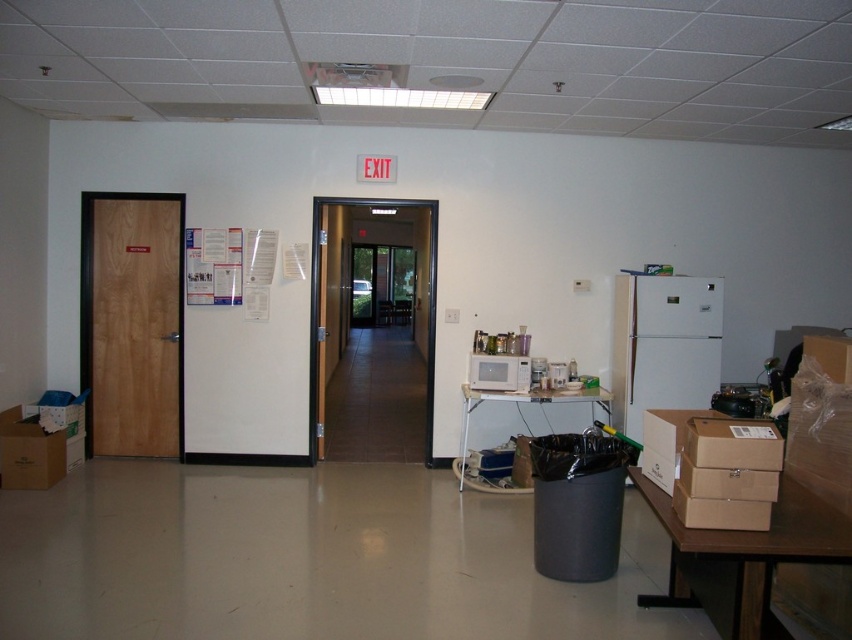
Who is higher up, wooden door at left or brown wooden door at center?

wooden door at left is higher up.

Is wooden door at left bigger than brown wooden door at center?

No.

Does point (90, 440) come in front of point (318, 406)?

Yes.

In order to click on wooden door at left in this screenshot , I will do `click(131, 323)`.

Looking at this image, is wooden door at left bigger than white paperboard bulletin board at upper left?

Yes.

Who is taller, wooden door at left or white paperboard bulletin board at upper left?

wooden door at left

Describe the element at coordinates (131, 323) in the screenshot. I see `wooden door at left` at that location.

The width and height of the screenshot is (852, 640). In order to click on wooden door at left in this screenshot , I will do `click(131, 323)`.

Between point (256, 314) and point (334, 196), which one is positioned behind?

The point (334, 196) is behind.

Is point (225, 230) behind point (429, 417)?

No, it is not.

The width and height of the screenshot is (852, 640). What are the coordinates of `white paperboard bulletin board at upper left` in the screenshot? It's located at (231, 268).

Locate an element on the screen. white paperboard bulletin board at upper left is located at coordinates (231, 268).